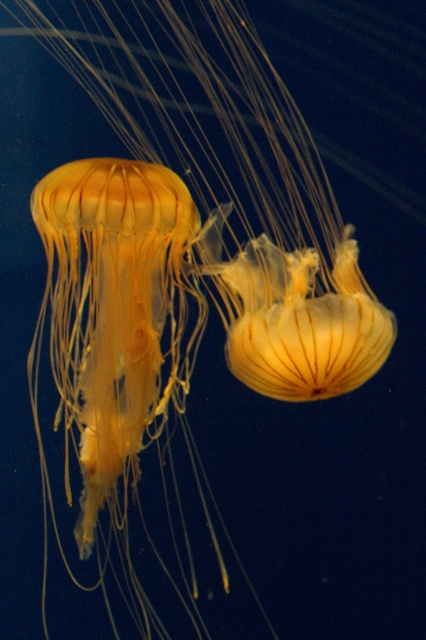
You are a marine biologist observing the underwater scene. You need to determine the position of the translucent yellow jellyfish at center relative to the center of the image. Is it to the left or right, and above or below the center point?

The translucent yellow jellyfish at center is located at point coordinates of 0.281 on the x and 0.547 on the y. Since the x value is less than 0.5, it is to the left of the center. The y value is greater than 0.5, so it is above the center point.

You are a marine biologist observing two jellyfish in an underwater scene. You notice the translucent yellow jellyfish at center and the translucent yellow jellyfish at left. Which jellyfish is positioned to the right of the other?

The translucent yellow jellyfish at center is positioned to the right of the translucent yellow jellyfish at left.